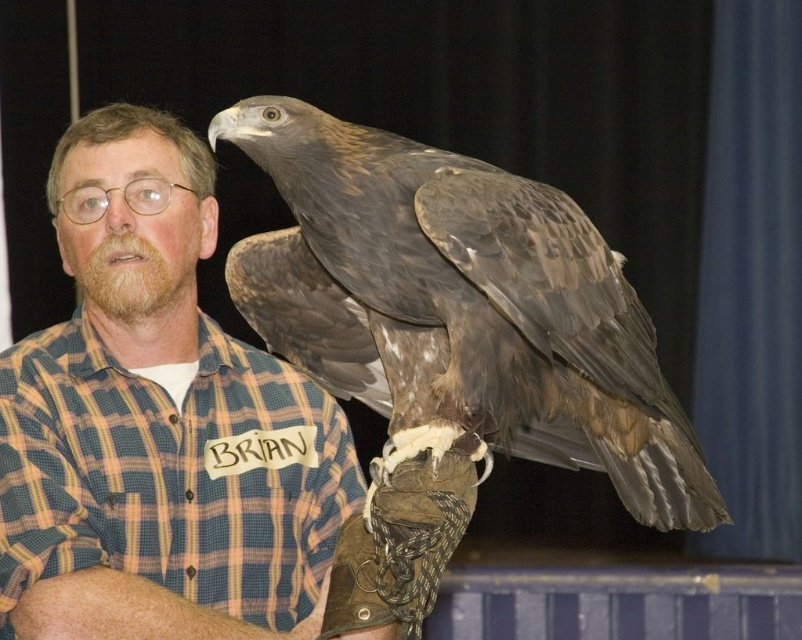
Where is the plaid shirt at center located in the image?

The plaid shirt at center is located at point (161, 428).

You are a photographer trying to capture a clear photo of the plaid shirt at center and the brown feathered falcon at upper right. If your camera has a minimum focus distance of 10 inches, will you be able to take the photo without moving closer?

The distance between the plaid shirt at center and the brown feathered falcon at upper right is 10.36 inches, which is just over the camera minimum focus distance of 10 inches. Therefore, you can take the photo without moving closer.